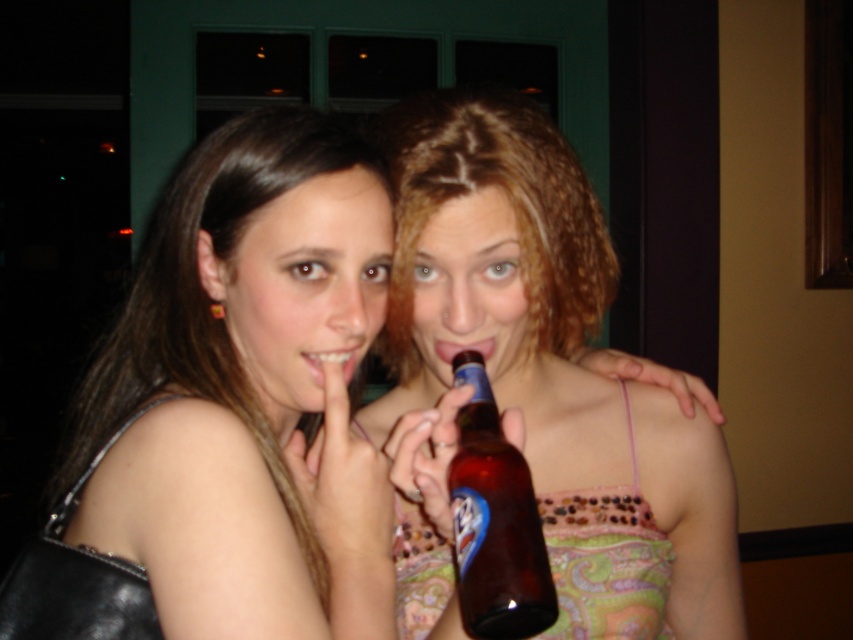
Based on the photo, is matte black purse at left bigger than brown fabric dress at center?

Incorrect, matte black purse at left is not larger than brown fabric dress at center.

Where is `matte black purse at left`? This screenshot has width=853, height=640. matte black purse at left is located at coordinates (248, 390).

Is matte black purse at left positioned at the back of brown glass bottle at center?

Yes, it is.

Is matte black purse at left smaller than brown glass bottle at center?

Incorrect, matte black purse at left is not smaller in size than brown glass bottle at center.

Find the location of a particular element. Image resolution: width=853 pixels, height=640 pixels. matte black purse at left is located at coordinates (248, 390).

The image size is (853, 640). What are the coordinates of `matte black purse at left` in the screenshot? It's located at (248, 390).

Between brown fabric dress at center and brown glass bottle at center, which one has less height?

brown glass bottle at center is shorter.

Is brown fabric dress at center shorter than brown glass bottle at center?

Incorrect, brown fabric dress at center's height does not fall short of brown glass bottle at center's.

Locate an element on the screen. brown fabric dress at center is located at coordinates (550, 365).

Identify the location of brown fabric dress at center. This screenshot has height=640, width=853. (550, 365).